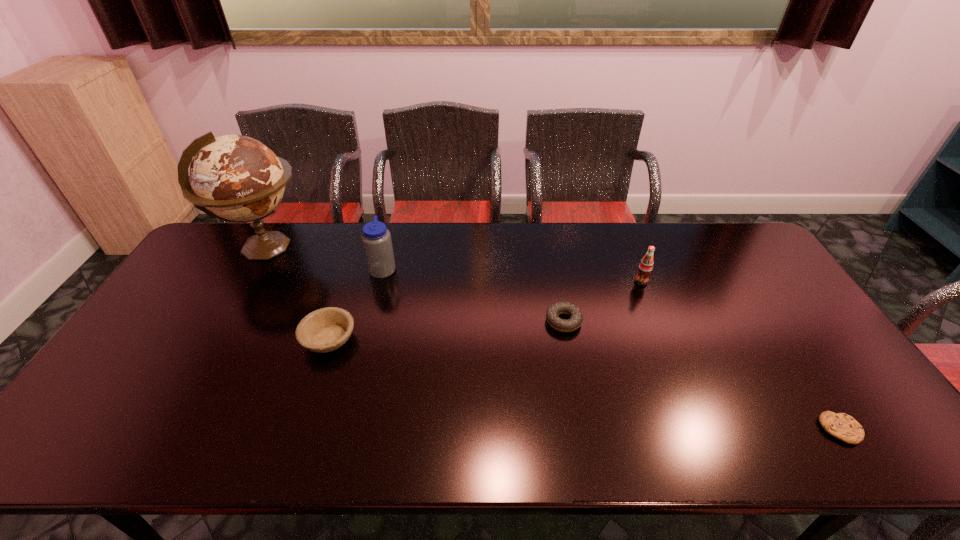
This screenshot has height=540, width=960. In order to click on globe in this screenshot , I will do `click(235, 178)`.

Where is `the tallest object`? This screenshot has width=960, height=540. the tallest object is located at coordinates (235, 178).

At what (x,y) coordinates should I click in order to perform the action: click on water bottle. Please return your answer as a coordinate pair (x, y). Looking at the image, I should click on (376, 239).

Image resolution: width=960 pixels, height=540 pixels. What are the coordinates of `the second object from right to left` in the screenshot? It's located at (645, 267).

Find the location of a particular element. This screenshot has width=960, height=540. soda is located at coordinates (645, 267).

You are a GUI agent. You are given a task and a screenshot of the screen. Output one action in this format:
    pyautogui.click(x=<x>, y=<y>)
    Task: Click on the fourth tallest object
    The width and height of the screenshot is (960, 540).
    Given the screenshot: What is the action you would take?
    (324, 330)

Where is `the second shortest object`? The width and height of the screenshot is (960, 540). the second shortest object is located at coordinates (576, 317).

This screenshot has height=540, width=960. I want to click on doughnut, so click(576, 317).

Locate an element on the screen. the shortest object is located at coordinates (842, 426).

At what (x,y) coordinates should I click in order to perform the action: click on cookie. Please return your answer as a coordinate pair (x, y). The image size is (960, 540). Looking at the image, I should click on (842, 426).